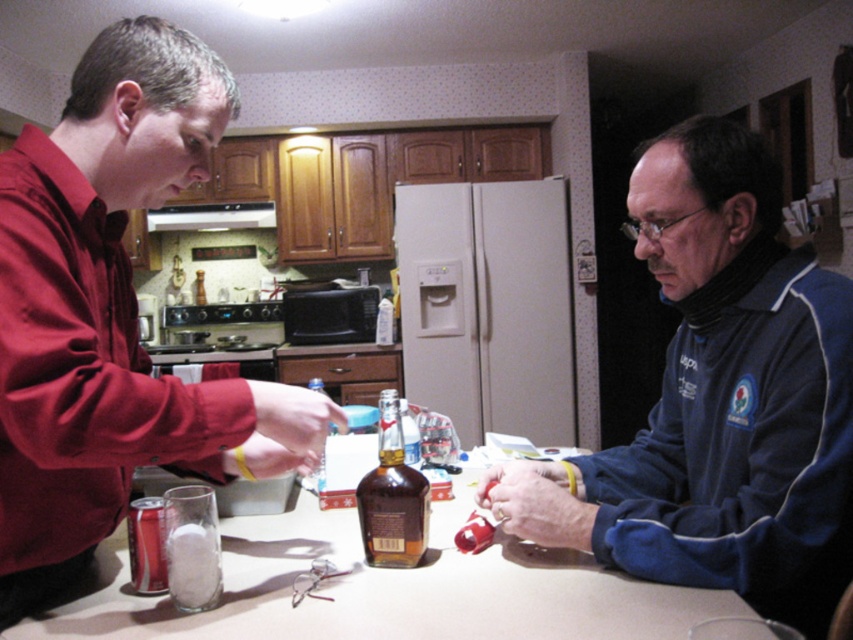
Who is shorter, matte red shirt at center or brown glass bottle at center?

With less height is brown glass bottle at center.

Can you confirm if matte red shirt at center is thinner than brown glass bottle at center?

No, matte red shirt at center is not thinner than brown glass bottle at center.

Does point (22, 262) lie behind point (374, 552)?

No, (22, 262) is in front of (374, 552).

Locate an element on the screen. The height and width of the screenshot is (640, 853). matte red shirt at center is located at coordinates (112, 316).

Between blue fleece jacket at center and brown glass bottle at center, which one appears on the right side from the viewer's perspective?

blue fleece jacket at center

Is point (729, 346) closer to camera compared to point (412, 492)?

Yes, point (729, 346) is in front of point (412, 492).

Where is `blue fleece jacket at center`? blue fleece jacket at center is located at coordinates (718, 400).

Does point (221, 432) lie in front of point (311, 547)?

Yes, it is in front of point (311, 547).

Is point (281, 394) more distant than point (642, 609)?

No, (281, 394) is in front of (642, 609).

Does point (192, 445) lie in front of point (463, 573)?

Yes.

Locate an element on the screen. matte red shirt at center is located at coordinates (112, 316).